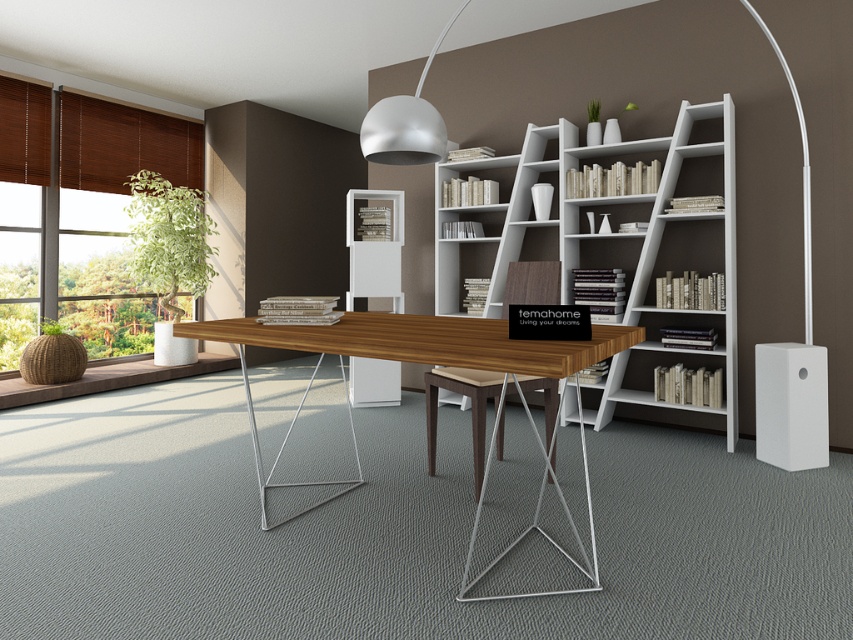
Who is positioned more to the right, white matte bookshelf at center or white matte speaker at lower right?

From the viewer's perspective, white matte speaker at lower right appears more on the right side.

Can you confirm if white matte bookshelf at center is wider than white matte speaker at lower right?

Yes.

The height and width of the screenshot is (640, 853). Find the location of `white matte bookshelf at center`. white matte bookshelf at center is located at coordinates (637, 246).

Can you confirm if white matte speaker at lower right is wider than matte white pendant light at upper center?

In fact, white matte speaker at lower right might be narrower than matte white pendant light at upper center.

Is white matte speaker at lower right taller than matte white pendant light at upper center?

No.

Does point (796, 381) come farther from viewer compared to point (378, 112)?

Yes, it is.

Where is `white matte speaker at lower right`? This screenshot has width=853, height=640. white matte speaker at lower right is located at coordinates click(791, 404).

Does wooden table at center appear on the right side of matte white pendant light at upper center?

Incorrect, wooden table at center is not on the right side of matte white pendant light at upper center.

Who is taller, wooden table at center or matte white pendant light at upper center?

wooden table at center

Who is more forward, [589,586] or [407,147]?

Point [589,586] is more forward.

Locate an element on the screen. The width and height of the screenshot is (853, 640). wooden table at center is located at coordinates (436, 364).